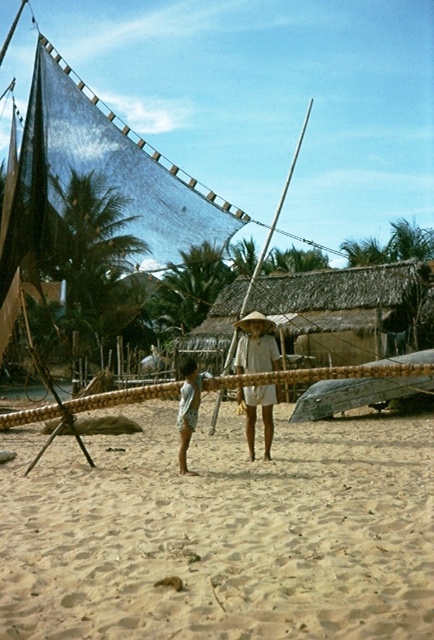
Which is more to the left, white woven hat at center or light blue cotton shorts at center?

Positioned to the left is light blue cotton shorts at center.

Does point (272, 323) come in front of point (184, 397)?

No, it is not.

Who is more forward, [246,371] or [186,468]?

Point [186,468]

Identify the location of white woven hat at center. The image size is (434, 640). (256, 346).

Who is positioned more to the right, light beige sand at center or white woven hat at center?

white woven hat at center is more to the right.

Can you confirm if light beige sand at center is positioned to the right of white woven hat at center?

In fact, light beige sand at center is to the left of white woven hat at center.

Who is more forward, (427, 480) or (253, 336)?

Point (427, 480)

This screenshot has height=640, width=434. What are the coordinates of `light beige sand at center` in the screenshot? It's located at (222, 532).

Is the position of light beige sand at center less distant than that of light blue cotton shorts at center?

Yes, it is in front of light blue cotton shorts at center.

Is light beige sand at center to the left of light blue cotton shorts at center from the viewer's perspective?

In fact, light beige sand at center is to the right of light blue cotton shorts at center.

Between point (279, 570) and point (187, 401), which one is positioned behind?

Point (187, 401)

This screenshot has height=640, width=434. Identify the location of light beige sand at center. (222, 532).